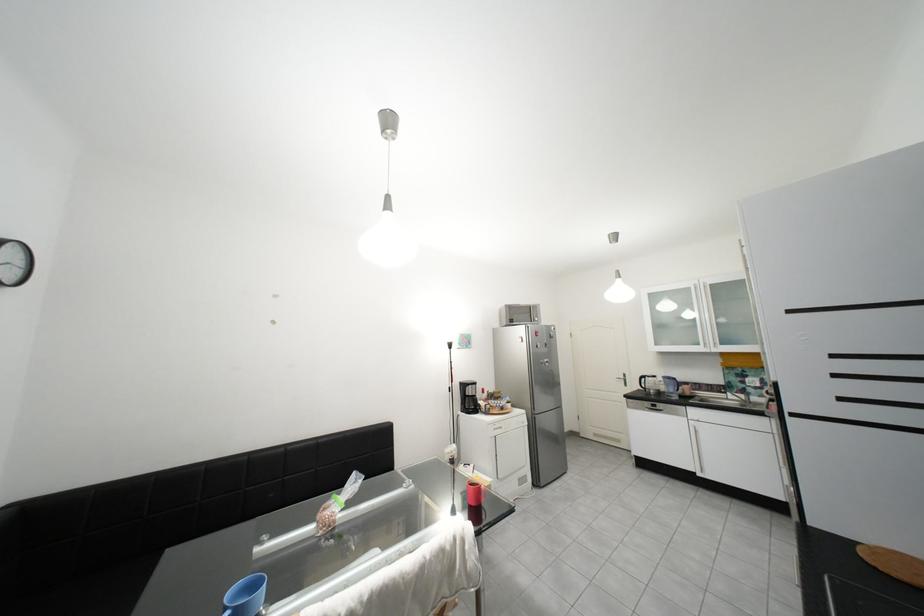
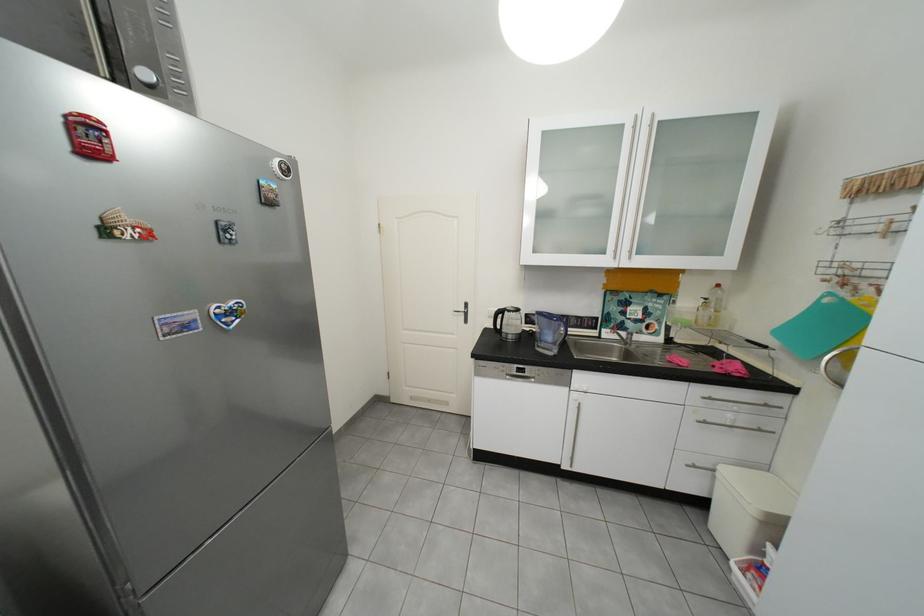
In the second image, find the point that corresponds to the point at 684,391 in the first image.

(561, 339)